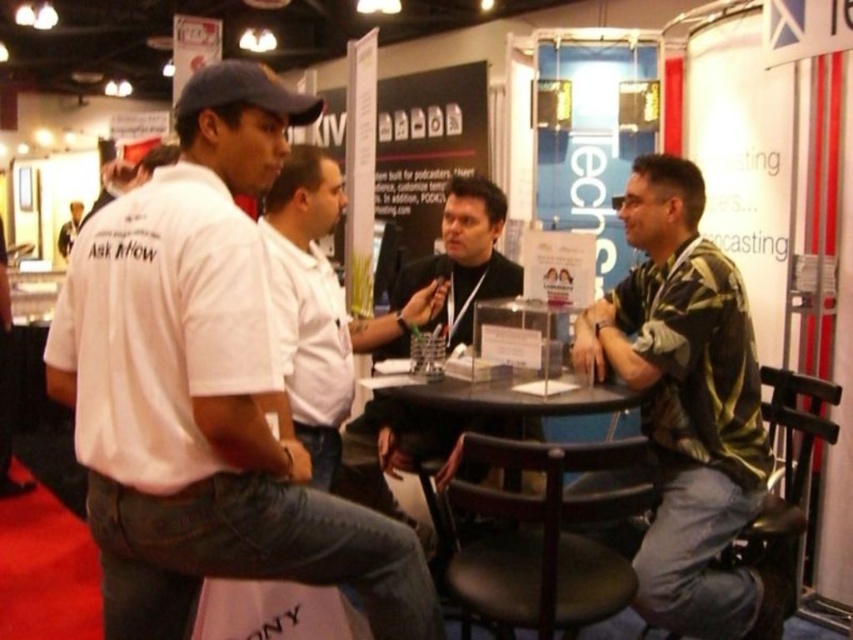
Question: Which of the following is the farthest from the observer?

Choices:
 (A) white cotton shirt at left
 (B) white cotton shirt at center
 (C) black leather jacket at center
 (D) white shirt at left

Answer: (D)

Question: Is black wood table at center bigger than white cotton shirt at center?

Choices:
 (A) no
 (B) yes

Answer: (A)

Question: Is green striped shirt at right further to the viewer compared to white shirt at left?

Choices:
 (A) yes
 (B) no

Answer: (B)

Question: Can you confirm if white cotton shirt at left is positioned above white cotton shirt at center?

Choices:
 (A) no
 (B) yes

Answer: (B)

Question: Among these points, which one is nearest to the camera?

Choices:
 (A) (219, 372)
 (B) (646, 554)
 (C) (490, 200)
 (D) (285, 221)

Answer: (A)

Question: Which is farther from the white cotton shirt at center?

Choices:
 (A) white cotton shirt at left
 (B) black leather jacket at center
 (C) green striped shirt at right
 (D) black wood table at center

Answer: (C)